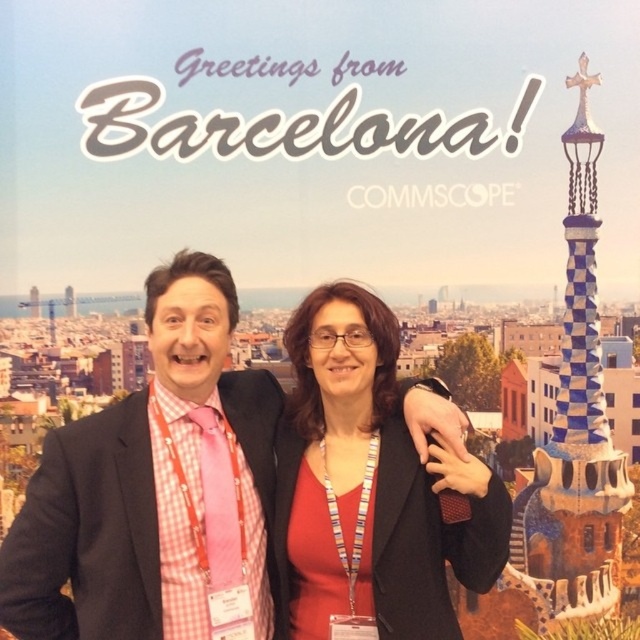
You are a photographer at the event and want to ensure the pink checkered shirt at center is centered in the photo. Given its current position at point 0.761 on the x axis and 0.241 on the y axis, what adjustment should you make to the camera frame to center it?

To center the pink checkered shirt at center, adjust the camera frame so that its position aligns with the center coordinates of the image, which would require moving it towards the center from its current position at point 0.761 on the x axis and 0.241 on the y axis.

You are a photographer at the event and need to adjust the camera to capture both the pink checkered shirt at center and the matte black jacket at center in the same frame. The camera has a maximum focus range of 8 meters. Will you be able to capture both subjects without moving the camera?

The pink checkered shirt at center and the matte black jacket at center are 8.60 meters apart from each other. Since the camera can only focus within 8 meters, the distance between them exceeds the camera range. Therefore, you cannot capture both subjects in the same frame without moving the camera.

You are a photographer at the event and need to adjust the camera focus. Since the pink checkered shirt at center and the matte black jacket at center are both in the frame, which one should you focus on if you want to ensure the larger object is sharp?

The pink checkered shirt at center is bigger than the matte black jacket at center, so you should focus on the pink checkered shirt at center to ensure the larger object is sharp.